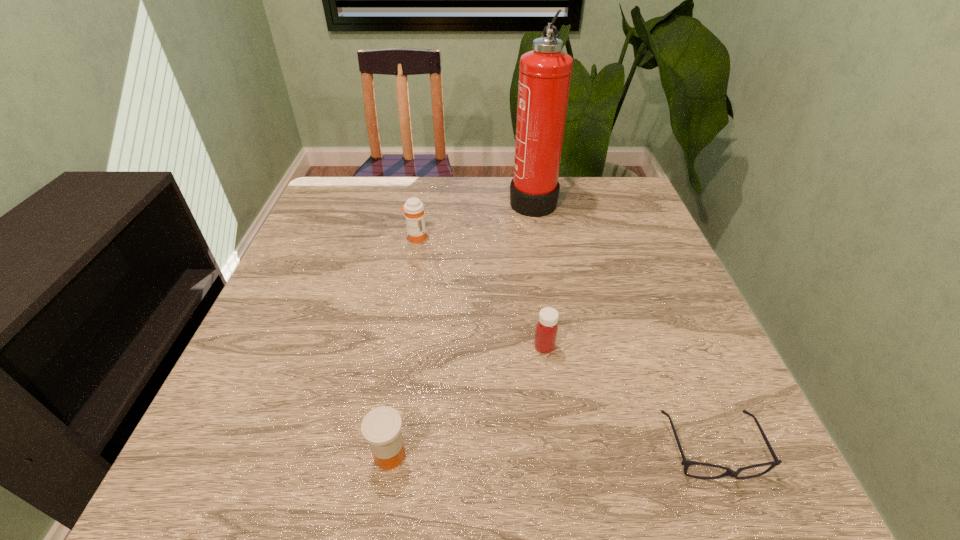
Image resolution: width=960 pixels, height=540 pixels. I want to click on empty space between the tallest object and the nearest medicine, so pyautogui.click(x=461, y=327).

Identify the location of empty location between the shortest object and the farthest medicine. (564, 343).

Locate an element on the screen. Image resolution: width=960 pixels, height=540 pixels. empty location between the farthest object and the nearest medicine is located at coordinates (461, 327).

Locate an element on the screen. empty space between the farthest medicine and the second nearest medicine is located at coordinates (480, 292).

Find the location of a particular element. The height and width of the screenshot is (540, 960). the third closest object to the second nearest medicine is located at coordinates (414, 209).

Image resolution: width=960 pixels, height=540 pixels. I want to click on object that ranks as the closest to the nearest medicine, so click(x=546, y=329).

Identify which medicine is the closest to the farthest object. Please provide its 2D coordinates. Your answer should be formatted as a tuple, i.e. [(x, y)], where the tuple contains the x and y coordinates of a point satisfying the conditions above.

[(414, 209)]

Identify the location of the second closest medicine to the farthest medicine. The height and width of the screenshot is (540, 960). (381, 427).